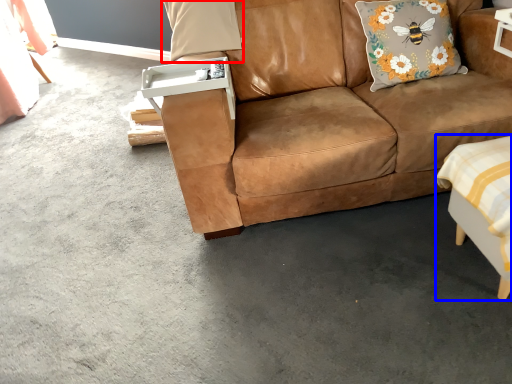
Question: Which point is closer to the camera, pillow (highlighted by a red box) or swivel chair (highlighted by a blue box)?

Choices:
 (A) pillow
 (B) swivel chair

Answer: (B)